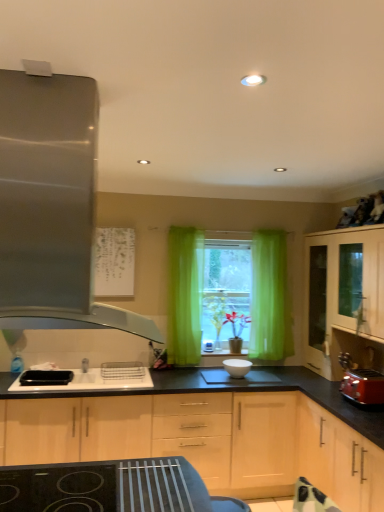
Question: Is point (193, 268) positioned closer to the camera than point (352, 374)?

Choices:
 (A) farther
 (B) closer

Answer: (A)

Question: Considering the positions of green sheer curtain at center and matte red toaster at right in the image, is green sheer curtain at center wider or thinner than matte red toaster at right?

Choices:
 (A) wide
 (B) thin

Answer: (B)

Question: Which of these objects is positioned closest to the light wood cabinet at right, the 1th cabinetry when ordered from right to left?

Choices:
 (A) green sheer curtain at center
 (B) light wood cabinet at lower right, the 2th cabinetry viewed from the right
 (C) light wood cabinet at center, positioned as the 3th cabinetry in right-to-left order
 (D) white glossy bowl at center
 (E) matte red toaster at right

Answer: (E)

Question: Which object is positioned closest to the green sheer curtain at center?

Choices:
 (A) light wood cabinet at lower right, the 2th cabinetry viewed from the left
 (B) white paper at upper center
 (C) light wood cabinet at center, acting as the 1th cabinetry starting from the left
 (D) matte red toaster at right
 (E) white glossy bowl at center

Answer: (B)